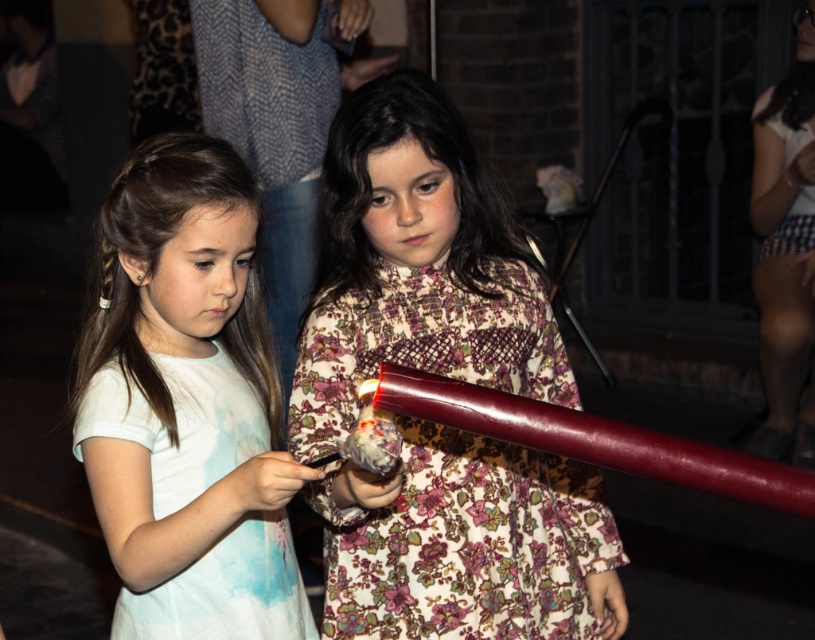
Is floral-patterned fabric dress at center to the right of white tie-dye fabric dress at left from the viewer's perspective?

Correct, you'll find floral-patterned fabric dress at center to the right of white tie-dye fabric dress at left.

Describe the element at coordinates (468, 544) in the screenshot. I see `floral-patterned fabric dress at center` at that location.

In order to click on floral-patterned fabric dress at center in this screenshot , I will do `click(468, 544)`.

The width and height of the screenshot is (815, 640). Find the location of `floral-patterned fabric dress at center`. floral-patterned fabric dress at center is located at coordinates (468, 544).